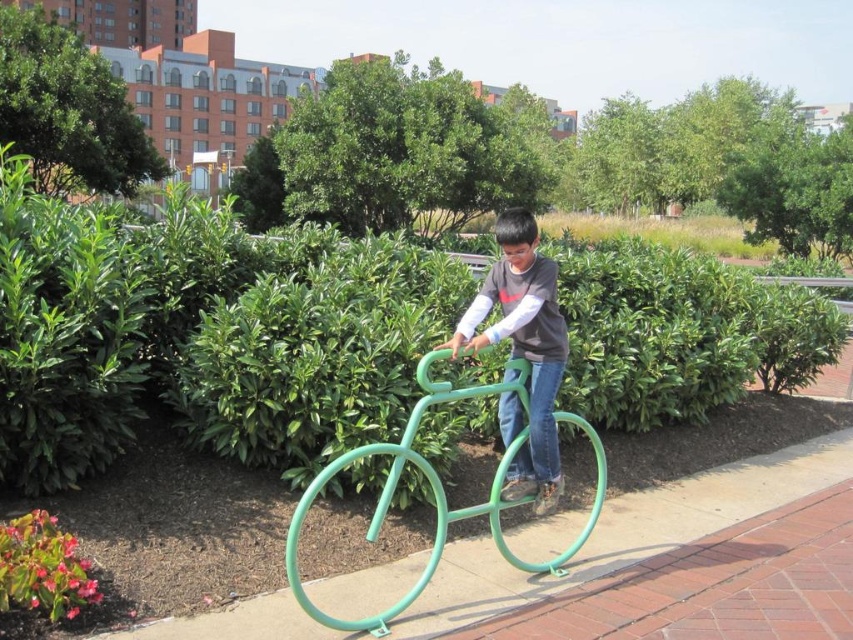
You are standing at the point with coordinates point [115,148] and want to walk to point [367,538]. Which direction should you move relative to your current position?

You should move towards the direction away from the camera since point [367,538] is closer to the camera than point [115,148].

In the scene shown: You are a photographer trying to capture a photo of the boy and the matte green bicycle at center without the green leafy bush at upper center blocking the view. Based on their sizes, can you position yourself in a way that the bush won

The green leafy bush at upper center is much taller than the matte green bicycle at center, so positioning yourself lower or moving to a spot where the bush is behind the bicycle might help avoid obstruction.

Looking at this image, you are a photographer aiming to capture the boy climbing the matte green bicycle at center without including the green leafy bush at upper center in the frame. Based on their positions, is this possible?

The green leafy bush at upper center is above the matte green bicycle at center, so if you position your camera below the bicycle and angle upwards, you can exclude the bush from the frame.